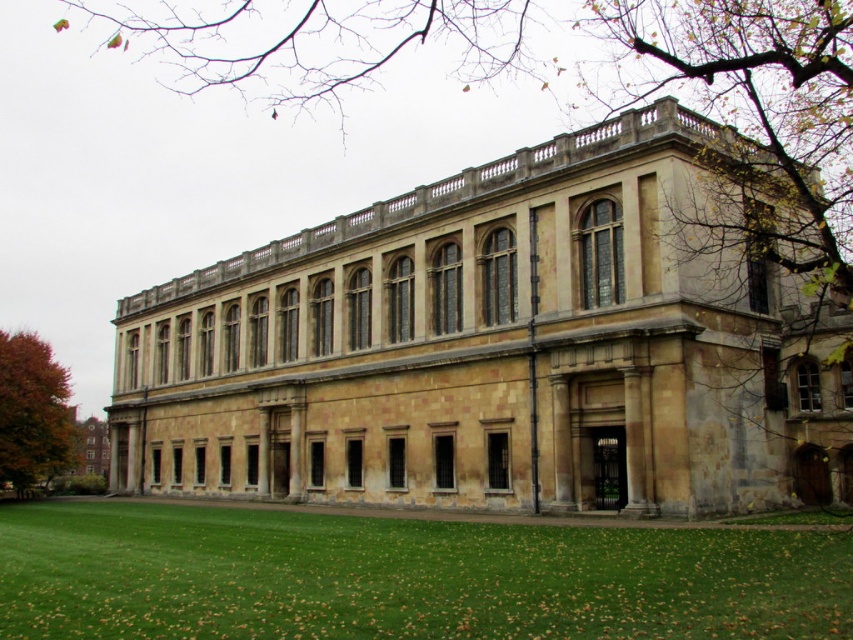
In the scene shown: Is yellow stone building at center below orange leafy tree at lower left?

No.

Between yellow stone building at center and orange leafy tree at lower left, which one appears on the left side from the viewer's perspective?

Positioned to the left is orange leafy tree at lower left.

Where is `yellow stone building at center`? The image size is (853, 640). yellow stone building at center is located at coordinates (498, 348).

Image resolution: width=853 pixels, height=640 pixels. I want to click on yellow stone building at center, so click(x=498, y=348).

Which is more to the right, green grass at lower center or orange leafy tree at lower left?

green grass at lower center

Which of these two, green grass at lower center or orange leafy tree at lower left, stands shorter?

green grass at lower center is shorter.

Where is `green grass at lower center`? This screenshot has width=853, height=640. green grass at lower center is located at coordinates [403, 577].

Can you confirm if yellow stone building at center is positioned above green grass at lower center?

Indeed, yellow stone building at center is positioned over green grass at lower center.

Where is `yellow stone building at center`? The width and height of the screenshot is (853, 640). yellow stone building at center is located at coordinates (498, 348).